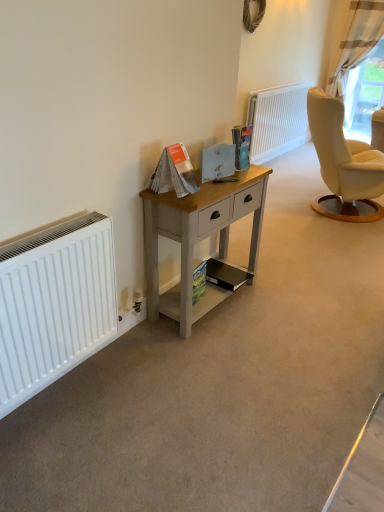
Image resolution: width=384 pixels, height=512 pixels. What are the coordinates of `free location in front of white matte radiator at lower left, which is the 1th radiator from left to right` in the screenshot? It's located at coord(67,439).